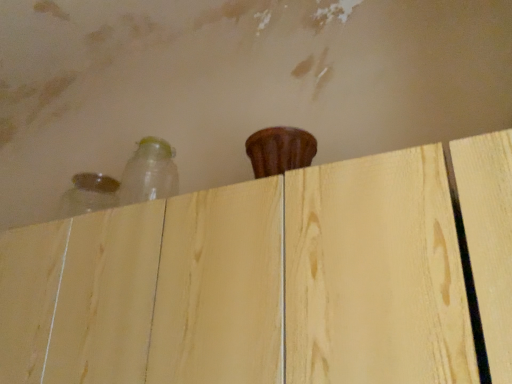
Question: From their relative heights in the image, would you say light wood dresser at upper center is taller or shorter than transparent plastic bottle at upper left, the second bottle from the left?

Choices:
 (A) tall
 (B) short

Answer: (A)

Question: Would you say light wood dresser at upper center is to the left or to the right of transparent plastic bottle at upper left, marked as the 1th bottle in a right-to-left arrangement, in the picture?

Choices:
 (A) right
 (B) left

Answer: (A)

Question: Estimate the real-world distances between objects in this image. Which object is closer to the translucent glass bottle at upper left, which appears as the 1th bottle when viewed from the left?

Choices:
 (A) light wood dresser at upper center
 (B) transparent plastic bottle at upper left, the second bottle from the left

Answer: (B)

Question: Which of these objects is positioned farthest from the translucent glass bottle at upper left, the 2th bottle when ordered from right to left?

Choices:
 (A) transparent plastic bottle at upper left, marked as the 1th bottle in a right-to-left arrangement
 (B) light wood dresser at upper center

Answer: (B)